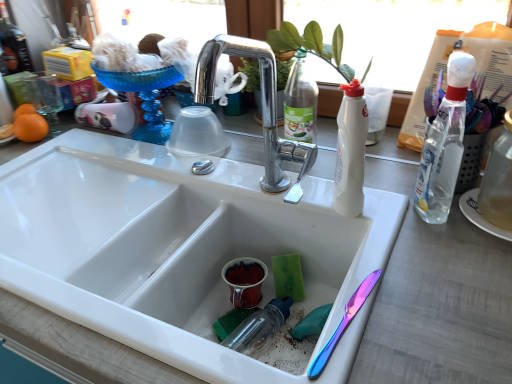
You are a GUI agent. You are given a task and a screenshot of the screen. Output one action in this format:
    pyautogui.click(x=<x>, y=<y>)
    Task: Click on the vacant position to the left of clear plastic bottle at right, the 2th bottle from the left
    The width and height of the screenshot is (512, 384).
    Given the screenshot: What is the action you would take?
    pyautogui.click(x=357, y=214)